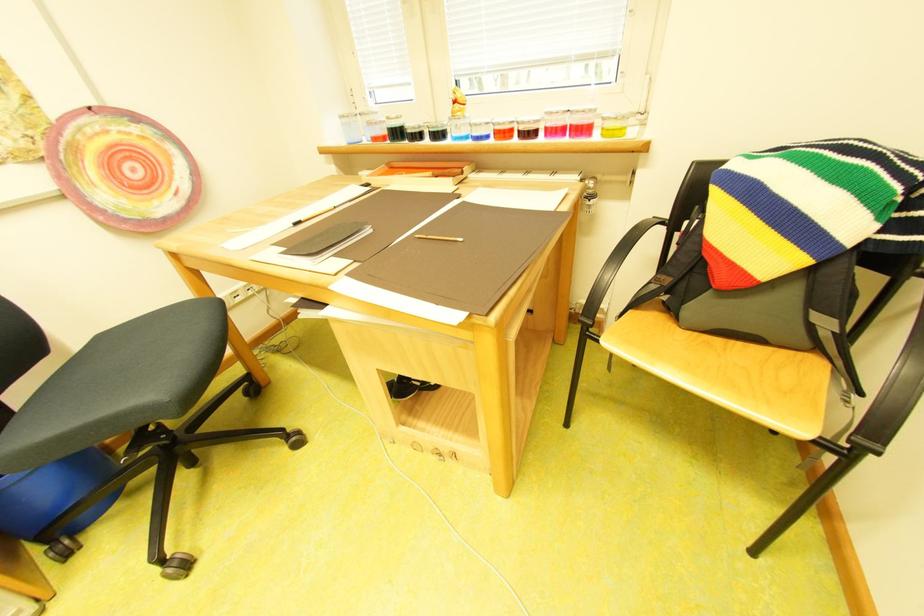
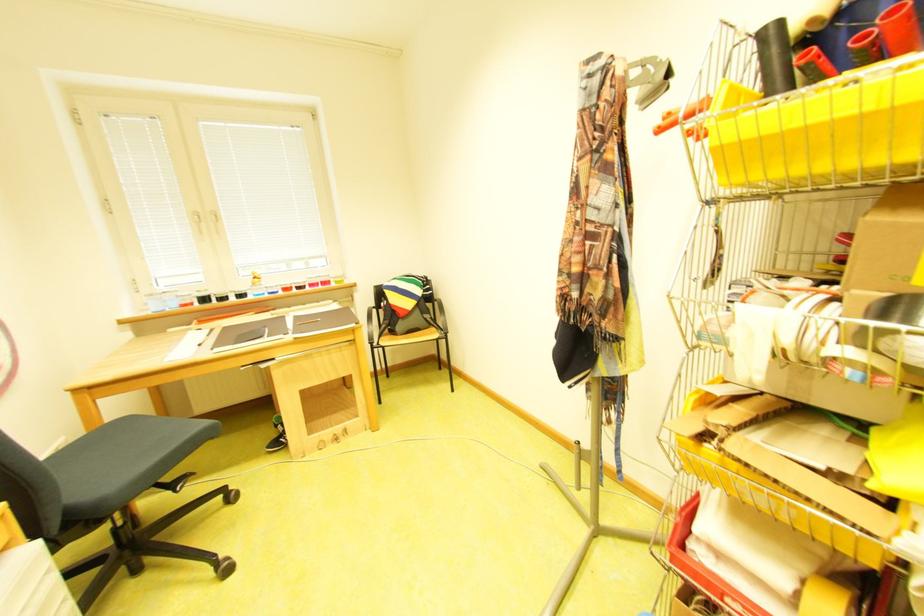
Find the pixel in the second image that matches the point at 816,342 in the first image.

(439, 326)